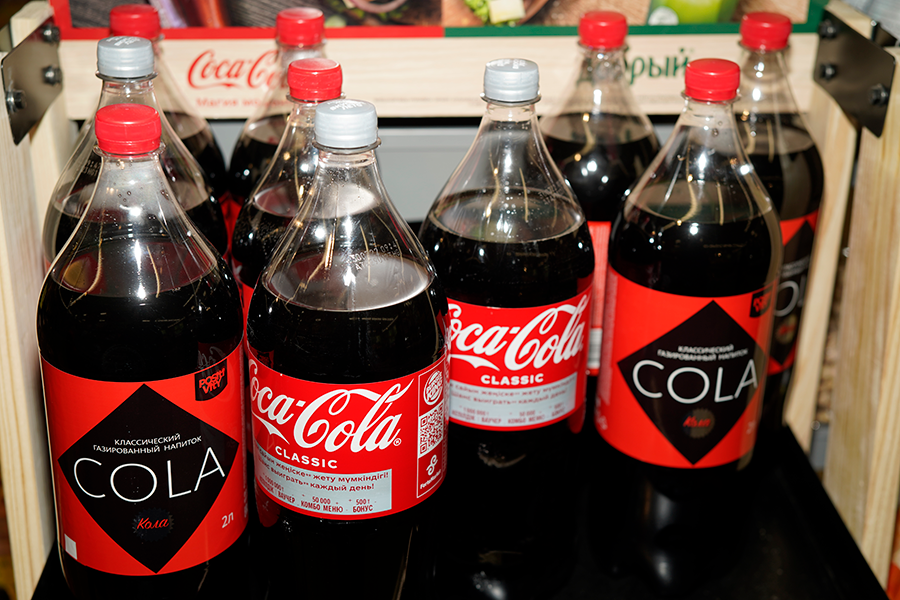
Locate an element on the screen. The width and height of the screenshot is (900, 600). wood planks is located at coordinates (6, 208), (48, 150), (425, 86), (842, 131), (880, 216).